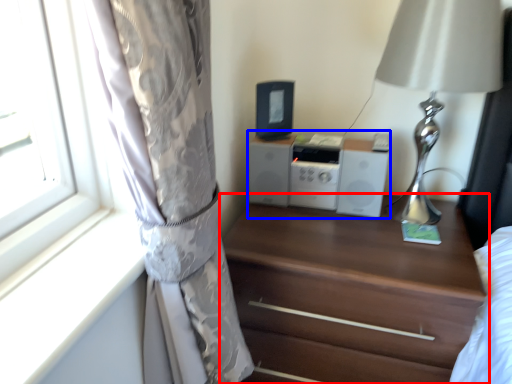
Question: Which object is closer to the camera taking this photo, chest of drawers (highlighted by a red box) or stereo (highlighted by a blue box)?

Choices:
 (A) chest of drawers
 (B) stereo

Answer: (A)